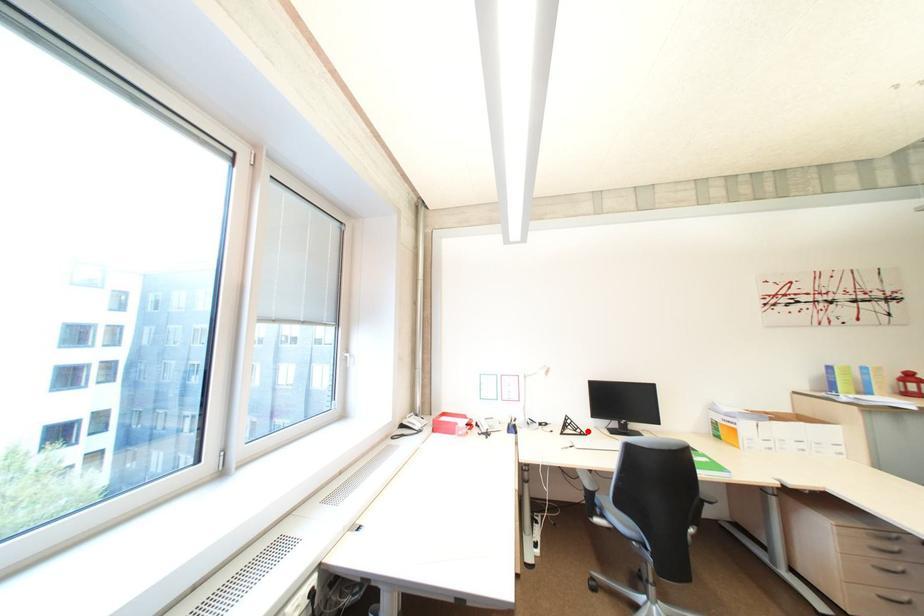
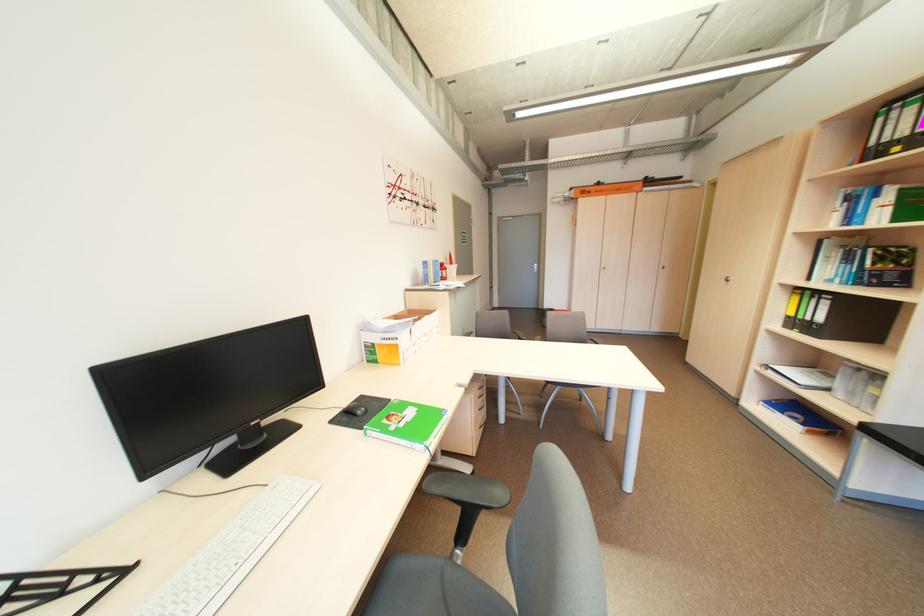
Find the pixel in the second image that matches the highlighted location in the first image.

(91, 582)